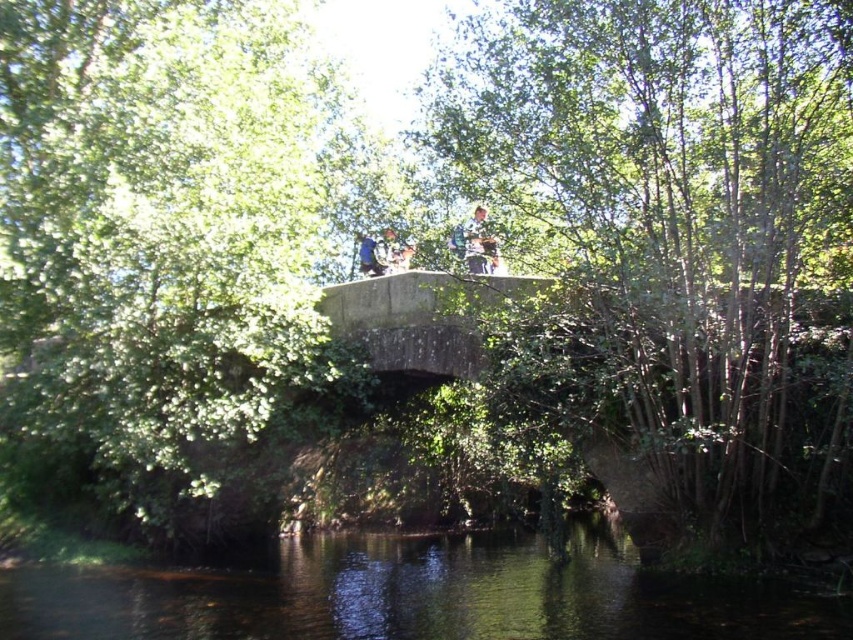
Is camouflage fabric person at center closer to camera compared to blue fabric person at center?

Yes, it is in front of blue fabric person at center.

Is point (477, 208) closer to viewer compared to point (370, 268)?

Yes, point (477, 208) is in front of point (370, 268).

Where is `camouflage fabric person at center`? This screenshot has height=640, width=853. camouflage fabric person at center is located at coordinates (479, 243).

Can you confirm if dark green water at center is positioned to the right of camouflage fabric person at center?

In fact, dark green water at center is to the left of camouflage fabric person at center.

Does dark green water at center come in front of camouflage fabric person at center?

Yes, it is in front of camouflage fabric person at center.

You are a GUI agent. You are given a task and a screenshot of the screen. Output one action in this format:
    pyautogui.click(x=<x>, y=<y>)
    Task: Click on the dark green water at center
    Image resolution: width=853 pixels, height=640 pixels.
    Given the screenshot: What is the action you would take?
    pyautogui.click(x=415, y=595)

Does dark green water at center appear over blue fabric person at center?

Actually, dark green water at center is below blue fabric person at center.

Who is more distant from viewer, (149, 632) or (363, 259)?

Point (363, 259)

Locate an element on the screen. This screenshot has width=853, height=640. dark green water at center is located at coordinates (415, 595).